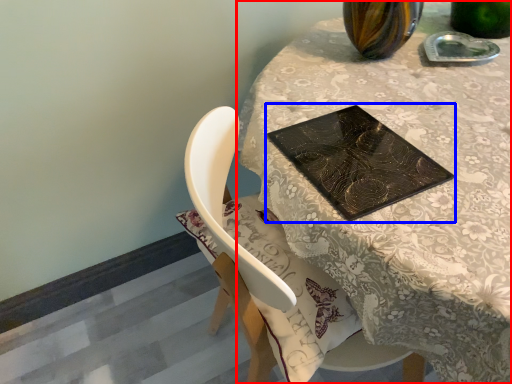
Question: Which object appears closest to the camera in this image, table (highlighted by a red box) or book cover (highlighted by a blue box)?

Choices:
 (A) table
 (B) book cover

Answer: (A)